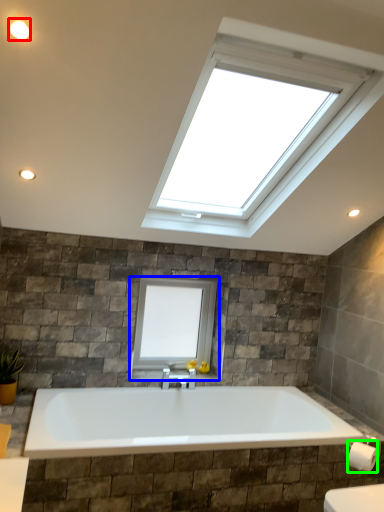
Question: Which object is positioned closest to lighting (highlighted by a red box)? Select from window (highlighted by a blue box) and toilet paper (highlighted by a green box).

Choices:
 (A) window
 (B) toilet paper

Answer: (A)